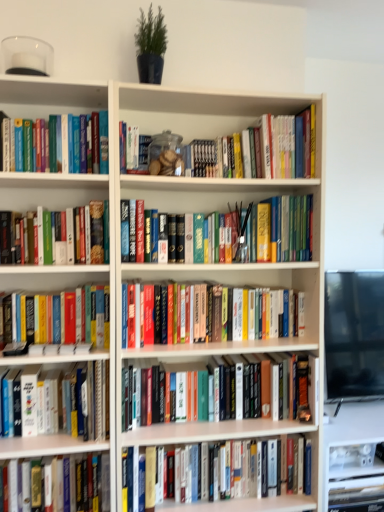
What is the approximate width of hardcover book at center, the 2th book in the bottom-to-top sequence?

It is 4.88 inches.

What do you see at coordinates (46, 144) in the screenshot? I see `hardcover books at upper left, the ninth book from the bottom` at bounding box center [46, 144].

Where is `hardcover books at center, which is the fifth book in top-to-bottom order`? The image size is (384, 512). hardcover books at center, which is the fifth book in top-to-bottom order is located at coordinates (203, 313).

What do you see at coordinates (80, 399) in the screenshot?
I see `hardcover book at lower left, the fourth book positioned from the bottom` at bounding box center [80, 399].

Find the location of a particular element. The image size is (384, 512). hardcover book at center, the 2th book in the bottom-to-top sequence is located at coordinates tap(244, 504).

Between hardcover books at left, the sixth book when ordered from bottom to top, and black glossy monitor at right, which one has less height?

With less height is hardcover books at left, the sixth book when ordered from bottom to top.

Does hardcover books at left, the sixth book when ordered from bottom to top, appear on the right side of black glossy monitor at right?

No, hardcover books at left, the sixth book when ordered from bottom to top, is not to the right of black glossy monitor at right.

Does hardcover books at left, positioned as the fourth book in top-to-bottom order, contain black glossy monitor at right?

Definitely not — black glossy monitor at right is not inside hardcover books at left, positioned as the fourth book in top-to-bottom order.

Is hardcover book at center, which is the 2th book from top to bottom, to the right of white matte bookcase at center from the viewer's perspective?

Yes.

Find the location of a particular element. bookcase that appears below the hardcover book at center, which is the 2th book from top to bottom (from a real-world perspective) is located at coordinates (159, 295).

Is hardcover book at center, which is counted as the eighth book, starting from the bottom, aimed at white matte bookcase at center?

Yes, hardcover book at center, which is counted as the eighth book, starting from the bottom, is turned towards white matte bookcase at center.

Is hardcover book at center, which appears as the 8th book when viewed from the top, positioned with its back to hardcover books at center, which is counted as the fifth book, starting from the bottom?

No, hardcover book at center, which appears as the 8th book when viewed from the top, is not facing the opposite direction of hardcover books at center, which is counted as the fifth book, starting from the bottom.

From a real-world perspective, relative to hardcover books at center, which is counted as the fifth book, starting from the bottom, is hardcover book at center, the 2th book in the bottom-to-top sequence, vertically above or below?

hardcover book at center, the 2th book in the bottom-to-top sequence, is below hardcover books at center, which is counted as the fifth book, starting from the bottom.

Considering the relative positions of hardcover book at center, the 2th book in the bottom-to-top sequence, and hardcover books at center, which is counted as the fifth book, starting from the bottom, in the image provided, is hardcover book at center, the 2th book in the bottom-to-top sequence, behind hardcover books at center, which is counted as the fifth book, starting from the bottom,?

Yes, the depth of hardcover book at center, the 2th book in the bottom-to-top sequence, is greater than that of hardcover books at center, which is counted as the fifth book, starting from the bottom.

Considering the sizes of objects hardcover book at center, the 2th book in the bottom-to-top sequence, and hardcover books at center, which is the fifth book in top-to-bottom order, in the image provided, who is taller, hardcover book at center, the 2th book in the bottom-to-top sequence, or hardcover books at center, which is the fifth book in top-to-bottom order,?

hardcover book at center, the 2th book in the bottom-to-top sequence.

Can you confirm if hardcover book at center, the 2th book in the bottom-to-top sequence, is positioned to the left of hardcover book at lower left, the fourth book positioned from the bottom?

In fact, hardcover book at center, the 2th book in the bottom-to-top sequence, is to the right of hardcover book at lower left, the fourth book positioned from the bottom.

Is hardcover book at lower left, the 6th book when ordered from top to bottom, located within hardcover book at center, the 2th book in the bottom-to-top sequence?

No.

In the scene shown: Considering the relative sizes of hardcover book at center, which appears as the 8th book when viewed from the top, and hardcover book at lower left, the fourth book positioned from the bottom, in the image provided, is hardcover book at center, which appears as the 8th book when viewed from the top, wider than hardcover book at lower left, the fourth book positioned from the bottom,?

No.

Is hardcover book at center, the 2th book in the bottom-to-top sequence, next to hardcover book at lower left, the 6th book when ordered from top to bottom, and touching it?

hardcover book at center, the 2th book in the bottom-to-top sequence, and hardcover book at lower left, the 6th book when ordered from top to bottom, are clearly separated.

From a real-world perspective, is hardcover book at lower left, the 6th book when ordered from top to bottom, below hardcover book at center, positioned as the third book in bottom-to-top order?

Actually, hardcover book at lower left, the 6th book when ordered from top to bottom, is physically above hardcover book at center, positioned as the third book in bottom-to-top order, in the real world.

Is hardcover book at lower left, the fourth book positioned from the bottom, situated inside hardcover book at center, the 7th book in the top-to-bottom sequence, or outside?

hardcover book at lower left, the fourth book positioned from the bottom, is located beyond the bounds of hardcover book at center, the 7th book in the top-to-bottom sequence.

You are a GUI agent. You are given a task and a screenshot of the screen. Output one action in this format:
    pyautogui.click(x=<x>, y=<y>)
    Task: Click on the 7th book behind the hardcover book at lower left, the 6th book when ordered from top to bottom, starting your count from the anchor
    Image resolution: width=384 pixels, height=512 pixels.
    Given the screenshot: What is the action you would take?
    pyautogui.click(x=211, y=396)

Is hardcover book at center, which is counted as the eighth book, starting from the bottom, facing away from hardcover book at center, positioned as the third book in bottom-to-top order?

No, hardcover book at center, positioned as the third book in bottom-to-top order, is not at the back of hardcover book at center, which is counted as the eighth book, starting from the bottom.

Consider the image. Which object is positioned more to the left, hardcover book at center, which is the 2th book from top to bottom, or hardcover book at center, positioned as the third book in bottom-to-top order?

From the viewer's perspective, hardcover book at center, which is the 2th book from top to bottom, appears more on the left side.

Between hardcover book at center, which is the 2th book from top to bottom, and hardcover book at center, positioned as the third book in bottom-to-top order, which one has smaller size?

hardcover book at center, which is the 2th book from top to bottom.

Starting from the hardcover book at center, positioned as the third book in bottom-to-top order, which book is the 1st one in front? Please provide its 2D coordinates.

[(282, 231)]

Looking at this image, would you say green matte plant at upper center is outside white matte bookcase at center?

Yes, green matte plant at upper center is not within white matte bookcase at center.

In the image, is green matte plant at upper center on the left side or the right side of white matte bookcase at center?

green matte plant at upper center is positioned on white matte bookcase at center's left side.

Looking at their sizes, would you say green matte plant at upper center is wider or thinner than white matte bookcase at center?

green matte plant at upper center is thinner than white matte bookcase at center.

From a real-world perspective, who is located higher, green matte plant at upper center or white matte bookcase at center?

From a 3D spatial view, green matte plant at upper center is above.

Starting from the black glossy monitor at right, which book is the 8th one to the left? Please provide its 2D coordinates.

[(58, 318)]

From the white matte bookcase at center, count 1st book to the right and point to it. Please provide its 2D coordinates.

[(282, 231)]

Considering their positions, is green matte plant at upper center positioned further to hardcover book at center, which is the 7th book in bottom-to-top order, than hardcover books at upper left, the ninth book from the bottom?

green matte plant at upper center.

When comparing their distances from black glossy monitor at right, does hardcover books at center, which is counted as the fifth book, starting from the bottom, or hardcover book at lower left, marked as the 9th book in a top-to-bottom arrangement, seem further?

The object further to black glossy monitor at right is hardcover book at lower left, marked as the 9th book in a top-to-bottom arrangement.

When comparing their distances from hardcover book at lower left, marked as the 9th book in a top-to-bottom arrangement, does hardcover books at left, the sixth book when ordered from bottom to top, or black glossy monitor at right seem closer?

hardcover books at left, the sixth book when ordered from bottom to top, is closer to hardcover book at lower left, marked as the 9th book in a top-to-bottom arrangement.

From the image, which object appears to be farther from hardcover book at center, which appears as the 8th book when viewed from the top, hardcover books at upper left, which is the first book in top-to-bottom order, or hardcover book at center, which is counted as the eighth book, starting from the bottom?

The object further to hardcover book at center, which appears as the 8th book when viewed from the top, is hardcover books at upper left, which is the first book in top-to-bottom order.

From the image, which object appears to be farther from hardcover book at center, which is counted as the eighth book, starting from the bottom, hardcover books at left, positioned as the fourth book in top-to-bottom order, or green matte plant at upper center?

green matte plant at upper center.

Looking at the image, which one is located closer to hardcover book at lower left, the 6th book when ordered from top to bottom, hardcover books at upper left, the ninth book from the bottom, or white matte bookcase at center?

Based on the image, white matte bookcase at center appears to be nearer to hardcover book at lower left, the 6th book when ordered from top to bottom.

Estimate the real-world distances between objects in this image. Which object is further from hardcover books at center, which is counted as the fifth book, starting from the bottom, hardcover books at left, positioned as the fourth book in top-to-bottom order, or black glossy monitor at right?

Among the two, black glossy monitor at right is located further to hardcover books at center, which is counted as the fifth book, starting from the bottom.

Which object lies further to the anchor point hardcover books at center, which is the fifth book in top-to-bottom order, hardcover book at center, the 2th book in the bottom-to-top sequence, or hardcover book at lower left, the 6th book when ordered from top to bottom?

Among the two, hardcover book at center, the 2th book in the bottom-to-top sequence, is located further to hardcover books at center, which is the fifth book in top-to-bottom order.

Find the location of a particular element. The height and width of the screenshot is (512, 384). computer monitor between green matte plant at upper center and hardcover book at center, the 2th book in the bottom-to-top sequence, in the vertical direction is located at coordinates (354, 335).

Where is `bookcase between hardcover book at center, which is the third book in top-to-bottom order, and hardcover book at lower left, the 6th book when ordered from top to bottom, in the vertical direction`? bookcase between hardcover book at center, which is the third book in top-to-bottom order, and hardcover book at lower left, the 6th book when ordered from top to bottom, in the vertical direction is located at coordinates (159, 295).

Where is `bookcase between hardcover book at center, which is the 2th book from top to bottom, and hardcover book at lower left, the fourth book positioned from the bottom, in the up-down direction`? The width and height of the screenshot is (384, 512). bookcase between hardcover book at center, which is the 2th book from top to bottom, and hardcover book at lower left, the fourth book positioned from the bottom, in the up-down direction is located at coordinates (159, 295).

Where is `plant located between hardcover book at lower left, the 6th book when ordered from top to bottom, and black glossy monitor at right in the left-right direction`? The height and width of the screenshot is (512, 384). plant located between hardcover book at lower left, the 6th book when ordered from top to bottom, and black glossy monitor at right in the left-right direction is located at coordinates (151, 46).